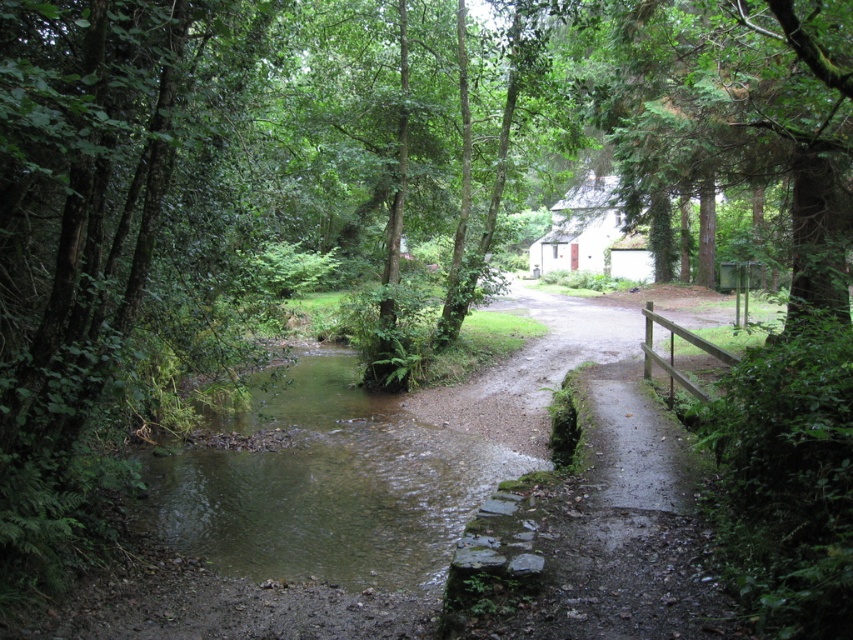
Question: Among these points, which one is farthest from the camera?

Choices:
 (A) (386, 394)
 (B) (763, 68)

Answer: (A)

Question: Does green mossy stream at center appear over green leafy tree at upper right?

Choices:
 (A) no
 (B) yes

Answer: (A)

Question: Is green mossy stream at center bigger than green leafy tree at upper right?

Choices:
 (A) no
 (B) yes

Answer: (A)

Question: Is green mossy stream at center wider than green leafy tree at upper right?

Choices:
 (A) no
 (B) yes

Answer: (A)